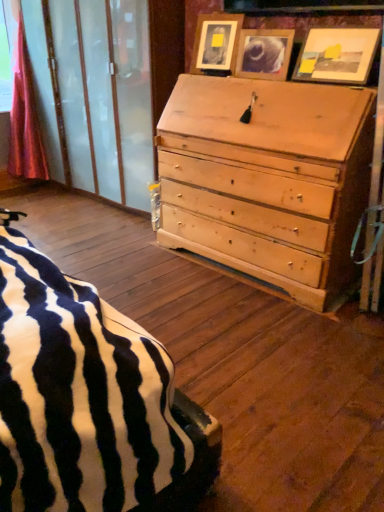
Question: Considering the relative sizes of pink satin curtain at left and wooden picture frame at upper center, placed as the first picture frame when sorted from left to right, in the image provided, is pink satin curtain at left thinner than wooden picture frame at upper center, placed as the first picture frame when sorted from left to right,?

Choices:
 (A) no
 (B) yes

Answer: (A)

Question: Is pink satin curtain at left far away from wooden picture frame at upper center, the third picture frame when ordered from right to left?

Choices:
 (A) no
 (B) yes

Answer: (B)

Question: Is pink satin curtain at left positioned beyond the bounds of wooden picture frame at upper center, placed as the first picture frame when sorted from left to right?

Choices:
 (A) yes
 (B) no

Answer: (A)

Question: From a real-world perspective, does pink satin curtain at left stand above wooden picture frame at upper center, placed as the first picture frame when sorted from left to right?

Choices:
 (A) yes
 (B) no

Answer: (B)

Question: Considering the relative positions of pink satin curtain at left and wooden picture frame at upper center, placed as the first picture frame when sorted from left to right, in the image provided, is pink satin curtain at left to the right of wooden picture frame at upper center, placed as the first picture frame when sorted from left to right, from the viewer's perspective?

Choices:
 (A) yes
 (B) no

Answer: (B)

Question: Is pink satin curtain at left to the left of wooden picture frame at upper center, placed as the first picture frame when sorted from left to right, from the viewer's perspective?

Choices:
 (A) no
 (B) yes

Answer: (B)

Question: Is wooden picture frame at upper center, placed as the first picture frame when sorted from left to right, completely or partially outside of matte wooden picture frame at upper center, the second picture frame from the left?

Choices:
 (A) yes
 (B) no

Answer: (A)

Question: Is wooden picture frame at upper center, the third picture frame when ordered from right to left, positioned with its back to matte wooden picture frame at upper center, the second picture frame positioned from the right?

Choices:
 (A) no
 (B) yes

Answer: (A)

Question: Considering the relative positions of wooden picture frame at upper center, the third picture frame when ordered from right to left, and matte wooden picture frame at upper center, the second picture frame positioned from the right, in the image provided, is wooden picture frame at upper center, the third picture frame when ordered from right to left, to the right of matte wooden picture frame at upper center, the second picture frame positioned from the right, from the viewer's perspective?

Choices:
 (A) no
 (B) yes

Answer: (A)

Question: From a real-world perspective, is wooden picture frame at upper center, placed as the first picture frame when sorted from left to right, physically below matte wooden picture frame at upper center, the second picture frame positioned from the right?

Choices:
 (A) yes
 (B) no

Answer: (B)

Question: Is wooden picture frame at upper center, placed as the first picture frame when sorted from left to right, facing towards matte wooden picture frame at upper center, the second picture frame positioned from the right?

Choices:
 (A) yes
 (B) no

Answer: (B)

Question: From the image's perspective, is wooden picture frame at upper center, placed as the first picture frame when sorted from left to right, under matte wooden picture frame at upper center, the second picture frame positioned from the right?

Choices:
 (A) no
 (B) yes

Answer: (A)

Question: From the image's perspective, is matte wooden picture frame at upper right, which ranks as the 3th picture frame in left-to-right order, beneath wooden picture frame at upper center, placed as the first picture frame when sorted from left to right?

Choices:
 (A) yes
 (B) no

Answer: (A)